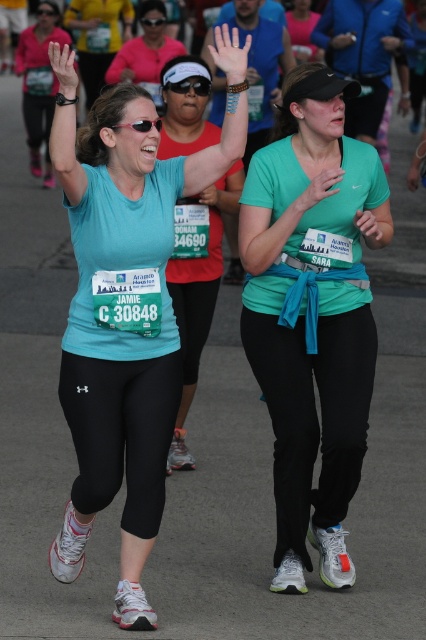
Question: Which of the following is the closest to the observer?

Choices:
 (A) pyautogui.click(x=157, y=28)
 (B) pyautogui.click(x=74, y=516)
 (C) pyautogui.click(x=311, y=147)

Answer: (B)

Question: Considering the relative positions of matte blue shirt at center and matte green shirt at center in the image provided, where is matte blue shirt at center located with respect to matte green shirt at center?

Choices:
 (A) below
 (B) above

Answer: (B)

Question: Which object is the farthest from the matte blue shirt at center?

Choices:
 (A) matte green shirt at center
 (B) matte teal shirt at center

Answer: (B)

Question: Can you confirm if matte blue shirt at center is wider than matte green shirt at center?

Choices:
 (A) yes
 (B) no

Answer: (A)

Question: Can you confirm if matte blue shirt at center is positioned to the left of matte teal shirt at center?

Choices:
 (A) yes
 (B) no

Answer: (B)

Question: Estimate the real-world distances between objects in this image. Which object is closer to the matte teal shirt at center?

Choices:
 (A) matte blue shirt at center
 (B) matte green shirt at center

Answer: (B)